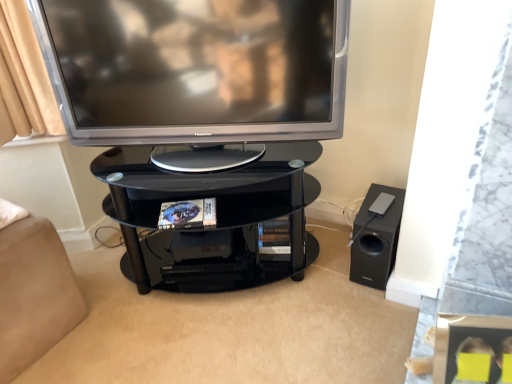
Image resolution: width=512 pixels, height=384 pixels. Find the location of `free location in front of black matte speaker at lower right`. free location in front of black matte speaker at lower right is located at coordinates (374, 311).